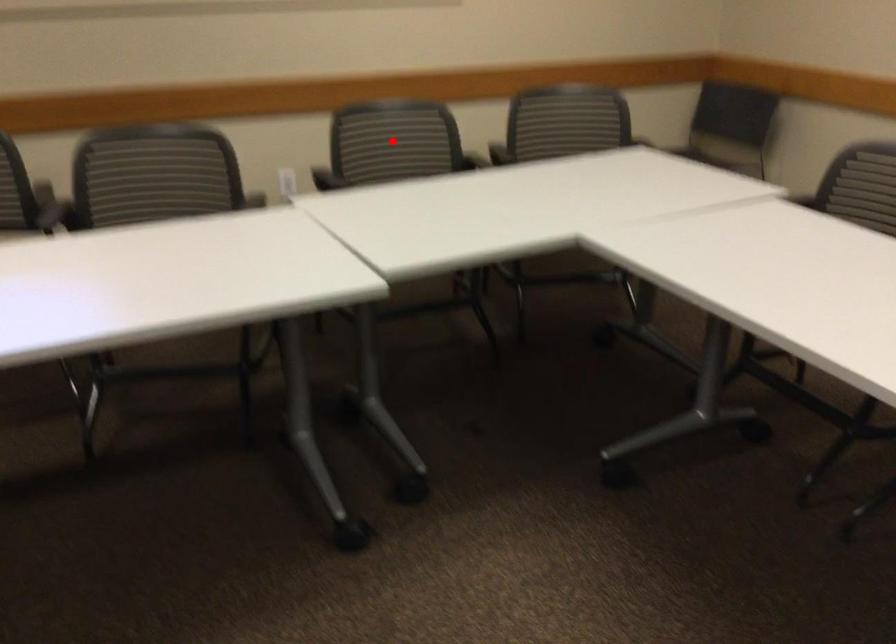
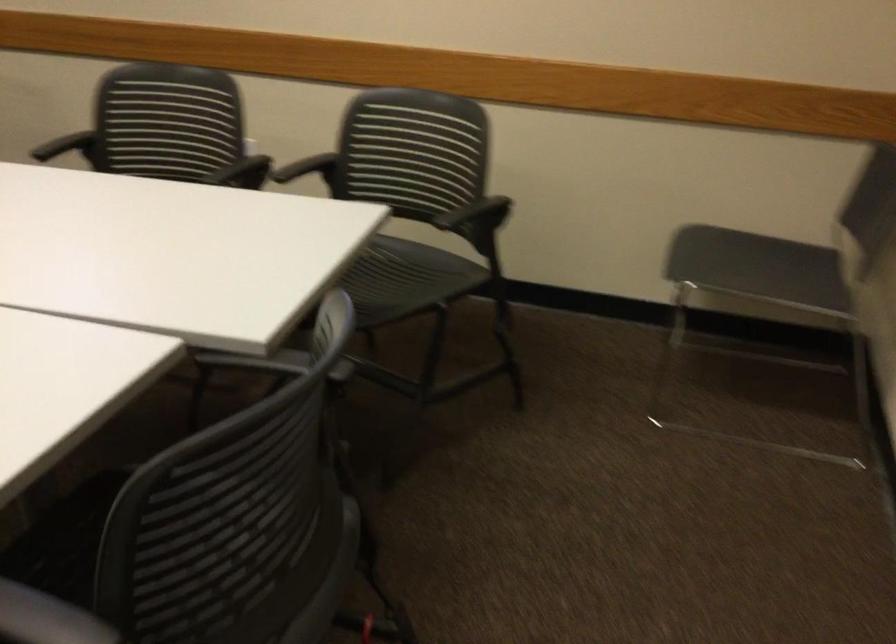
Question: I am providing you with two images of the same scene from different viewpoints. A red point is marked on the first image. Is the red point's position out of view in image 2?

Choices:
 (A) Yes
 (B) No

Answer: (A)